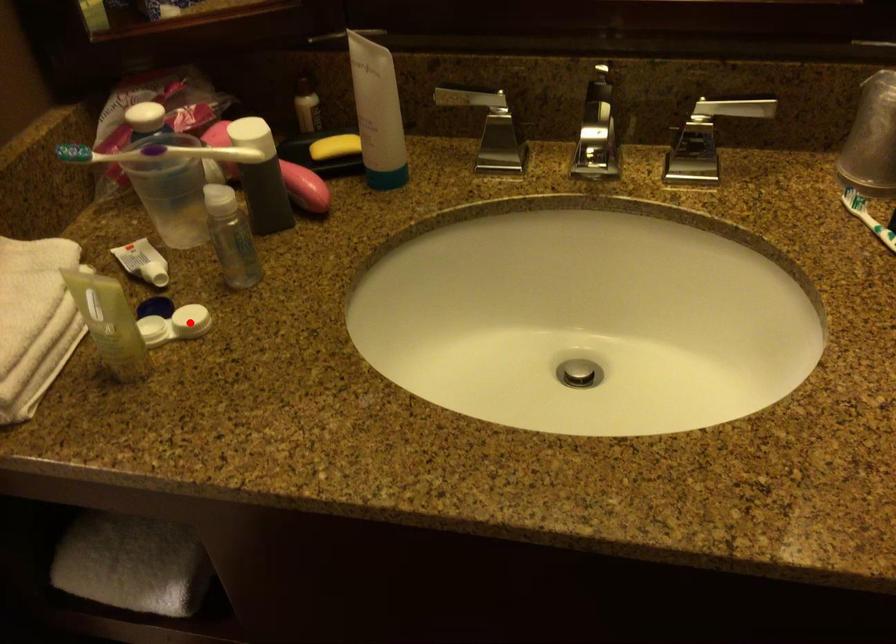
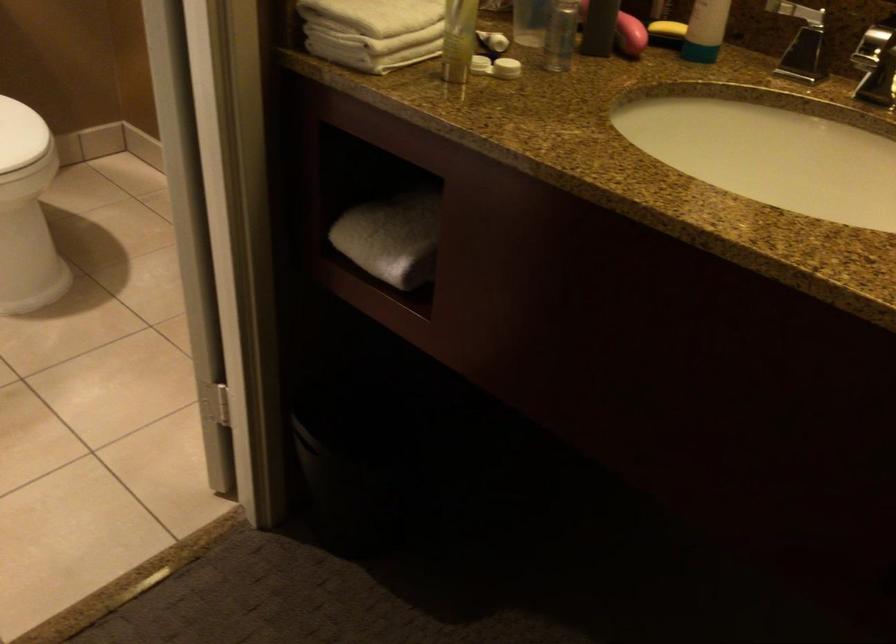
Locate, in the second image, the point that corresponds to the highlighted location in the first image.

(506, 68)